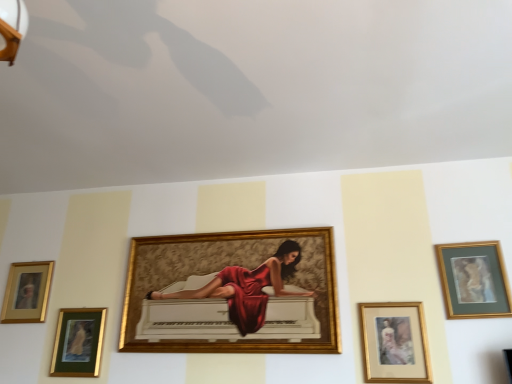
Measure the distance between gold-framed portrait at lower right, which is the 2th picture frame from right to left, and camera.

The distance of gold-framed portrait at lower right, which is the 2th picture frame from right to left, from camera is 1.78 meters.

Where is `gold-framed painting at center, which appears as the third picture frame when viewed from the right`? gold-framed painting at center, which appears as the third picture frame when viewed from the right is located at coordinates (232, 293).

At what (x,y) coordinates should I click in order to perform the action: click on gold/glossy picture frame at lower left, arranged as the 1th picture frame when viewed from the left. Please return your answer as a coordinate pair (x, y). This screenshot has height=384, width=512. Looking at the image, I should click on (27, 292).

Is gold-framed portrait at lower right, marked as the fourth picture frame in a left-to-right arrangement, next to gold/glossy picture frame at lower left, arranged as the 1th picture frame when viewed from the left, and touching it?

gold-framed portrait at lower right, marked as the fourth picture frame in a left-to-right arrangement, and gold/glossy picture frame at lower left, arranged as the 1th picture frame when viewed from the left, are clearly separated.

From the image's perspective, is gold-framed portrait at lower right, which is the 2th picture frame from right to left, on top of gold/glossy picture frame at lower left, the 5th picture frame viewed from the right?

Actually, gold-framed portrait at lower right, which is the 2th picture frame from right to left, appears below gold/glossy picture frame at lower left, the 5th picture frame viewed from the right, in the image.

Could you measure the distance between gold-framed portrait at lower right, which is the 2th picture frame from right to left, and gold/glossy picture frame at lower left, the 5th picture frame viewed from the right?

A distance of 5.82 feet exists between gold-framed portrait at lower right, which is the 2th picture frame from right to left, and gold/glossy picture frame at lower left, the 5th picture frame viewed from the right.

Which object is thinner, gold-framed portrait at lower right, which is the 2th picture frame from right to left, or gold/glossy picture frame at lower left, arranged as the 1th picture frame when viewed from the left?

With smaller width is gold-framed portrait at lower right, which is the 2th picture frame from right to left.

In terms of width, does gold/glass picture frame at lower left, the 4th picture frame positioned from the right, look wider or thinner when compared to gold/glossy picture frame at lower left, the 5th picture frame viewed from the right?

In the image, gold/glass picture frame at lower left, the 4th picture frame positioned from the right, appears to be wider than gold/glossy picture frame at lower left, the 5th picture frame viewed from the right.

Based on the photo, is gold/glass picture frame at lower left, which is counted as the second picture frame, starting from the left, not within gold/glossy picture frame at lower left, arranged as the 1th picture frame when viewed from the left?

Absolutely, gold/glass picture frame at lower left, which is counted as the second picture frame, starting from the left, is external to gold/glossy picture frame at lower left, arranged as the 1th picture frame when viewed from the left.

From the picture: From a real-world perspective, is gold/glass picture frame at lower left, which is counted as the second picture frame, starting from the left, on top of gold/glossy picture frame at lower left, arranged as the 1th picture frame when viewed from the left?

Actually, gold/glass picture frame at lower left, which is counted as the second picture frame, starting from the left, is physically below gold/glossy picture frame at lower left, arranged as the 1th picture frame when viewed from the left, in the real world.

I want to click on the 3rd picture frame to the left of the gold-framed artwork at upper right, which appears as the fifth picture frame when viewed from the left, starting your count from the anchor, so click(x=78, y=342).

Considering the relative sizes of gold/glass picture frame at lower left, which is counted as the second picture frame, starting from the left, and gold-framed artwork at upper right, placed as the first picture frame when sorted from right to left, in the image provided, is gold/glass picture frame at lower left, which is counted as the second picture frame, starting from the left, bigger than gold-framed artwork at upper right, placed as the first picture frame when sorted from right to left,?

No.

Who is shorter, gold/glass picture frame at lower left, which is counted as the second picture frame, starting from the left, or gold-framed artwork at upper right, placed as the first picture frame when sorted from right to left?

gold/glass picture frame at lower left, which is counted as the second picture frame, starting from the left.

In the image, is gold-framed painting at center, which appears as the third picture frame when viewed from the right, on the left side or the right side of gold/glossy picture frame at lower left, the 5th picture frame viewed from the right?

From the image, it's evident that gold-framed painting at center, which appears as the third picture frame when viewed from the right, is to the right of gold/glossy picture frame at lower left, the 5th picture frame viewed from the right.

Does gold-framed painting at center, placed as the third picture frame when sorted from left to right, have a lesser width compared to gold/glossy picture frame at lower left, arranged as the 1th picture frame when viewed from the left?

No, gold-framed painting at center, placed as the third picture frame when sorted from left to right, is not thinner than gold/glossy picture frame at lower left, arranged as the 1th picture frame when viewed from the left.

Is gold-framed painting at center, which appears as the third picture frame when viewed from the right, taller or shorter than gold/glossy picture frame at lower left, the 5th picture frame viewed from the right?

In the image, gold-framed painting at center, which appears as the third picture frame when viewed from the right, appears to be taller than gold/glossy picture frame at lower left, the 5th picture frame viewed from the right.

From a real-world perspective, which object rests below the other?

From a 3D spatial view, gold-framed painting at center, placed as the third picture frame when sorted from left to right, is below.

Consider the image. Which object is further away from the camera, gold-framed portrait at lower right, which is the 2th picture frame from right to left, or gold-framed painting at center, which appears as the third picture frame when viewed from the right?

gold-framed painting at center, which appears as the third picture frame when viewed from the right, is behind.

From the image's perspective, is gold-framed portrait at lower right, which is the 2th picture frame from right to left, above or below gold-framed painting at center, placed as the third picture frame when sorted from left to right?

Clearly, from the image's perspective, gold-framed portrait at lower right, which is the 2th picture frame from right to left, is below gold-framed painting at center, placed as the third picture frame when sorted from left to right.

Could you measure the distance between gold-framed portrait at lower right, marked as the fourth picture frame in a left-to-right arrangement, and gold-framed painting at center, placed as the third picture frame when sorted from left to right?

gold-framed portrait at lower right, marked as the fourth picture frame in a left-to-right arrangement, and gold-framed painting at center, placed as the third picture frame when sorted from left to right, are 47.31 centimeters apart.

Which picture frame is the 1st one when counting from the left side of the gold-framed portrait at lower right, marked as the fourth picture frame in a left-to-right arrangement? Please provide its 2D coordinates.

[(232, 293)]

Considering the sizes of objects gold-framed artwork at upper right, which appears as the fifth picture frame when viewed from the left, and gold/glossy picture frame at lower left, the 5th picture frame viewed from the right, in the image provided, who is smaller, gold-framed artwork at upper right, which appears as the fifth picture frame when viewed from the left, or gold/glossy picture frame at lower left, the 5th picture frame viewed from the right,?

gold/glossy picture frame at lower left, the 5th picture frame viewed from the right, is smaller.

From a real-world perspective, is gold-framed artwork at upper right, placed as the first picture frame when sorted from right to left, on gold/glossy picture frame at lower left, arranged as the 1th picture frame when viewed from the left?

Yes, from a real-world perspective, gold-framed artwork at upper right, placed as the first picture frame when sorted from right to left, is on top of gold/glossy picture frame at lower left, arranged as the 1th picture frame when viewed from the left.

Between gold-framed artwork at upper right, which appears as the fifth picture frame when viewed from the left, and gold/glossy picture frame at lower left, the 5th picture frame viewed from the right, which one is positioned in front?

gold-framed artwork at upper right, which appears as the fifth picture frame when viewed from the left.

Is gold/glass picture frame at lower left, the 4th picture frame positioned from the right, aimed at gold-framed portrait at lower right, marked as the fourth picture frame in a left-to-right arrangement?

No, gold/glass picture frame at lower left, the 4th picture frame positioned from the right, is not turned towards gold-framed portrait at lower right, marked as the fourth picture frame in a left-to-right arrangement.

Is gold/glass picture frame at lower left, which is counted as the second picture frame, starting from the left, far from gold-framed portrait at lower right, which is the 2th picture frame from right to left?

Yes, gold/glass picture frame at lower left, which is counted as the second picture frame, starting from the left, and gold-framed portrait at lower right, which is the 2th picture frame from right to left, are located far from each other.

Find the location of `the 2nd picture frame counting from the right side of the gold/glass picture frame at lower left, the 4th picture frame positioned from the right`. the 2nd picture frame counting from the right side of the gold/glass picture frame at lower left, the 4th picture frame positioned from the right is located at coordinates (394, 343).

Considering the sizes of objects gold/glass picture frame at lower left, the 4th picture frame positioned from the right, and gold-framed portrait at lower right, marked as the fourth picture frame in a left-to-right arrangement, in the image provided, who is smaller, gold/glass picture frame at lower left, the 4th picture frame positioned from the right, or gold-framed portrait at lower right, marked as the fourth picture frame in a left-to-right arrangement,?

gold-framed portrait at lower right, marked as the fourth picture frame in a left-to-right arrangement.

Find the location of `picture frame that is the 1st one when counting upward from the gold-framed portrait at lower right, which is the 2th picture frame from right to left (from the image's perspective)`. picture frame that is the 1st one when counting upward from the gold-framed portrait at lower right, which is the 2th picture frame from right to left (from the image's perspective) is located at coordinates (27, 292).

Which picture frame is the 1st one when counting from the right side of the gold/glossy picture frame at lower left, arranged as the 1th picture frame when viewed from the left? Please provide its 2D coordinates.

[(78, 342)]

Estimate the real-world distances between objects in this image. Which object is closer to gold-framed painting at center, placed as the third picture frame when sorted from left to right, gold/glossy picture frame at lower left, the 5th picture frame viewed from the right, or gold-framed artwork at upper right, which appears as the fifth picture frame when viewed from the left?

gold-framed artwork at upper right, which appears as the fifth picture frame when viewed from the left, is positioned closer to the anchor gold-framed painting at center, placed as the third picture frame when sorted from left to right.

From the image, which object appears to be nearer to gold/glass picture frame at lower left, which is counted as the second picture frame, starting from the left, gold-framed artwork at upper right, placed as the first picture frame when sorted from right to left, or gold-framed painting at center, which appears as the third picture frame when viewed from the right?

Among the two, gold-framed painting at center, which appears as the third picture frame when viewed from the right, is located nearer to gold/glass picture frame at lower left, which is counted as the second picture frame, starting from the left.

Looking at the image, which one is located further to gold/glossy picture frame at lower left, the 5th picture frame viewed from the right, gold-framed artwork at upper right, which appears as the fifth picture frame when viewed from the left, or gold/glass picture frame at lower left, the 4th picture frame positioned from the right?

Among the two, gold-framed artwork at upper right, which appears as the fifth picture frame when viewed from the left, is located further to gold/glossy picture frame at lower left, the 5th picture frame viewed from the right.

Consider the image. When comparing their distances from gold-framed portrait at lower right, marked as the fourth picture frame in a left-to-right arrangement, does gold/glass picture frame at lower left, the 4th picture frame positioned from the right, or gold-framed artwork at upper right, placed as the first picture frame when sorted from right to left, seem further?

Based on the image, gold/glass picture frame at lower left, the 4th picture frame positioned from the right, appears to be further to gold-framed portrait at lower right, marked as the fourth picture frame in a left-to-right arrangement.

Looking at the image, which one is located further to gold-framed artwork at upper right, placed as the first picture frame when sorted from right to left, gold/glossy picture frame at lower left, arranged as the 1th picture frame when viewed from the left, or gold/glass picture frame at lower left, which is counted as the second picture frame, starting from the left?

Among the two, gold/glossy picture frame at lower left, arranged as the 1th picture frame when viewed from the left, is located further to gold-framed artwork at upper right, placed as the first picture frame when sorted from right to left.

From the image, which object appears to be nearer to gold-framed portrait at lower right, marked as the fourth picture frame in a left-to-right arrangement, gold-framed artwork at upper right, placed as the first picture frame when sorted from right to left, or gold-framed painting at center, which appears as the third picture frame when viewed from the right?

Based on the image, gold-framed artwork at upper right, placed as the first picture frame when sorted from right to left, appears to be nearer to gold-framed portrait at lower right, marked as the fourth picture frame in a left-to-right arrangement.

Based on their spatial positions, is gold/glass picture frame at lower left, which is counted as the second picture frame, starting from the left, or gold-framed painting at center, which appears as the third picture frame when viewed from the right, further from gold-framed artwork at upper right, which appears as the fifth picture frame when viewed from the left?

Based on the image, gold/glass picture frame at lower left, which is counted as the second picture frame, starting from the left, appears to be further to gold-framed artwork at upper right, which appears as the fifth picture frame when viewed from the left.

Based on their spatial positions, is gold/glossy picture frame at lower left, the 5th picture frame viewed from the right, or gold/glass picture frame at lower left, which is counted as the second picture frame, starting from the left, closer to gold-framed painting at center, placed as the third picture frame when sorted from left to right?

gold/glass picture frame at lower left, which is counted as the second picture frame, starting from the left, lies closer to gold-framed painting at center, placed as the third picture frame when sorted from left to right, than the other object.

The width and height of the screenshot is (512, 384). Find the location of `picture frame located between gold/glass picture frame at lower left, the 4th picture frame positioned from the right, and gold-framed portrait at lower right, marked as the fourth picture frame in a left-to-right arrangement, in the left-right direction`. picture frame located between gold/glass picture frame at lower left, the 4th picture frame positioned from the right, and gold-framed portrait at lower right, marked as the fourth picture frame in a left-to-right arrangement, in the left-right direction is located at coordinates (232, 293).

You are a GUI agent. You are given a task and a screenshot of the screen. Output one action in this format:
    pyautogui.click(x=<x>, y=<y>)
    Task: Click on the picture frame between gold-framed painting at center, placed as the third picture frame when sorted from left to right, and gold-framed artwork at upper right, which appears as the fifth picture frame when viewed from the left
    This screenshot has height=384, width=512.
    Given the screenshot: What is the action you would take?
    pyautogui.click(x=394, y=343)

Image resolution: width=512 pixels, height=384 pixels. In order to click on picture frame situated between gold/glossy picture frame at lower left, arranged as the 1th picture frame when viewed from the left, and gold-framed painting at center, placed as the third picture frame when sorted from left to right, from left to right in this screenshot , I will do `click(78, 342)`.